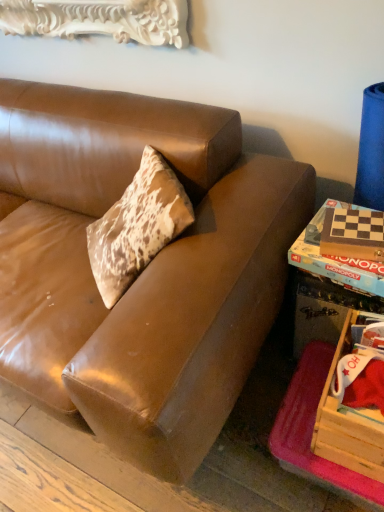
This screenshot has height=512, width=384. I want to click on free space above wooden monopoly game at right, placed as the first book when sorted from back to front (from a real-world perspective), so click(342, 241).